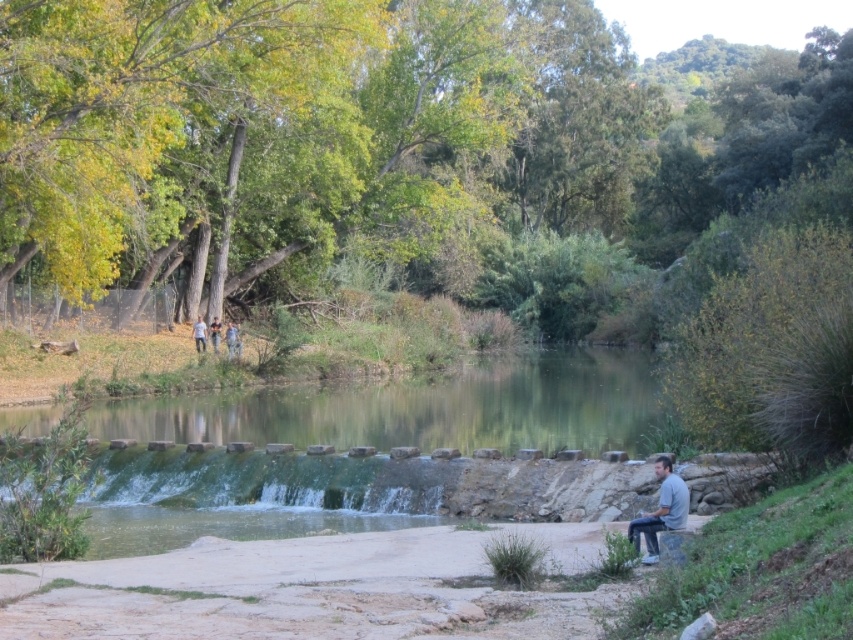
You are standing at the base of the dam in the scene. You need to place a small backpack on the ground near the light brown leather jacket at upper center. According to the coordinates provided, where should you place the backpack?

The light brown leather jacket at upper center is located at coordinates point (x=231, y=339), so you should place the backpack near that point.

You are standing on the dam and want to cross to the other side. You see clear water at center and light blue jeans at center. Which path should you take to avoid getting your shoes wet?

The clear water at center has a larger size compared to light blue jeans at center. Therefore, the light blue jeans at center is smaller and likely a safer, drier path to take to avoid getting your shoes wet.

You are standing on the dam and see the clear water at center and the gray cotton shirt at lower right. Which object is closer to your right side?

The gray cotton shirt at lower right is closer to your right side because it is positioned on the right side of the clear water at center.